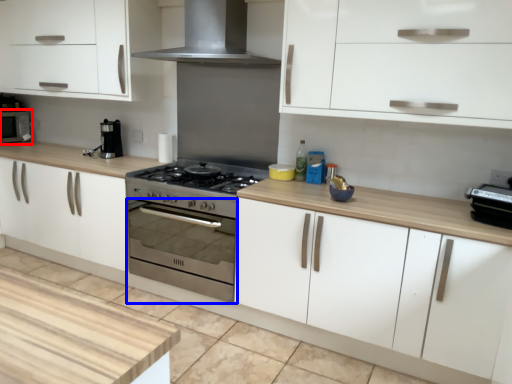
Question: Which object is further to the camera taking this photo, microwave (highlighted by a red box) or oven (highlighted by a blue box)?

Choices:
 (A) microwave
 (B) oven

Answer: (A)